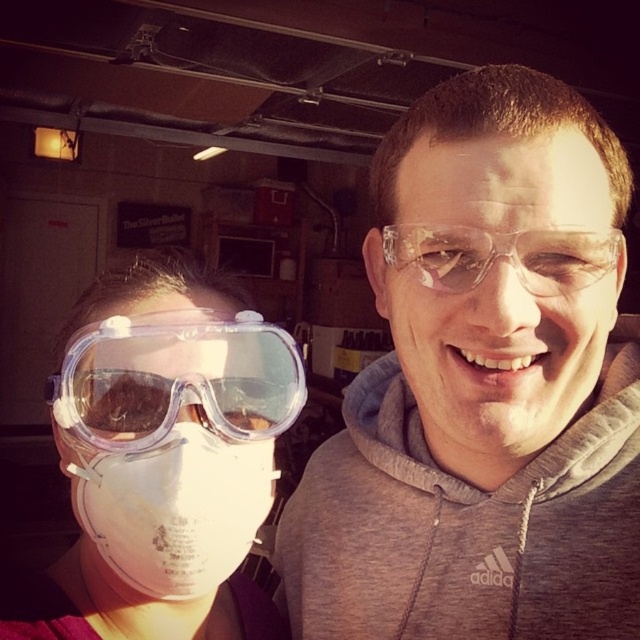
You are a safety inspector in the workshop. You notice two protective eyewear items, the clear plastic glasses at center and the transparent plastic goggles at left. Which one is closer to you?

The clear plastic glasses at center is closer to you because it is in front of the transparent plastic goggles at left.

You are an inspector checking safety equipment in a workshop. You notice two pairs of goggles, the clear plastic goggles at left and the transparent plastic goggles at left. Which pair is located more to the left?

The clear plastic goggles at left is positioned on the left side of transparent plastic goggles at left, so the clear plastic goggles at left is more to the left.

You are a safety inspector in a workshop. You need to ensure that all protective eyewear is properly spaced to avoid contamination. The minimum required distance between any two eyewear items is 6 inches. Are the clear plastic glasses at center and transparent plastic goggles at left meeting this requirement?

The distance between the clear plastic glasses at center and transparent plastic goggles at left is 7.12 inches, which exceeds the minimum required 6 inches, so they are meeting the requirement.